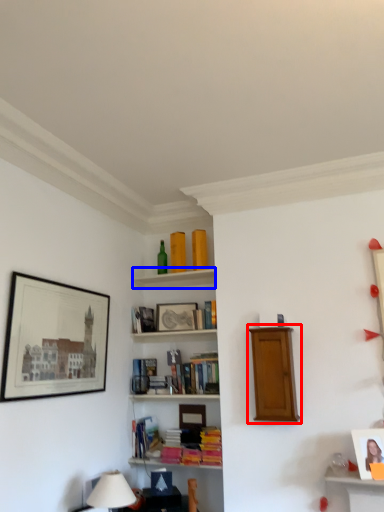
Question: Which object is closer to the camera taking this photo, shelf (highlighted by a red box) or cabinet (highlighted by a blue box)?

Choices:
 (A) shelf
 (B) cabinet

Answer: (A)